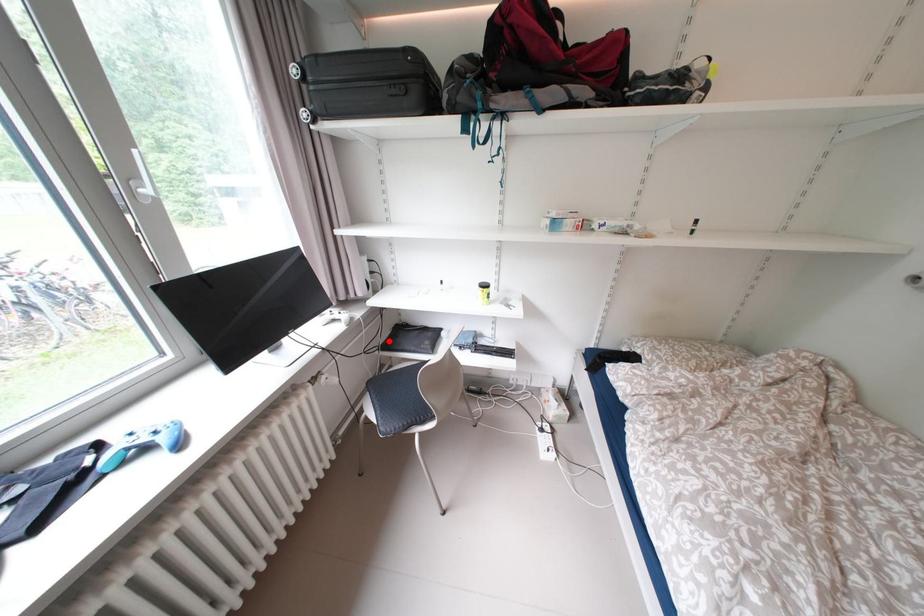
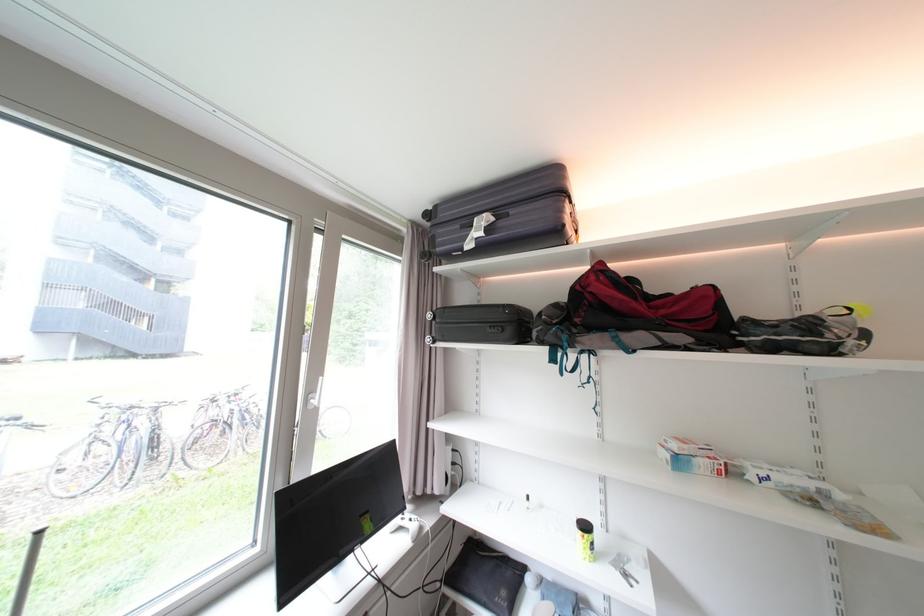
The point at the highlighted location is marked in the first image. Where is the corresponding point in the second image?

(455, 567)